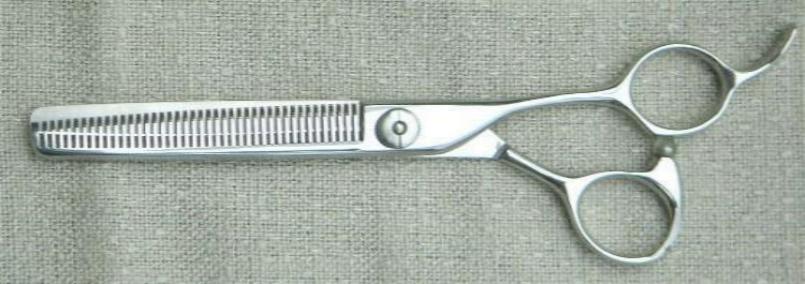
You are a GUI agent. You are given a task and a screenshot of the screen. Output one action in this format:
    pyautogui.click(x=<x>, y=<y>)
    Task: Click on the small stain
    Image resolution: width=805 pixels, height=284 pixels.
    Given the screenshot: What is the action you would take?
    pyautogui.click(x=129, y=32)